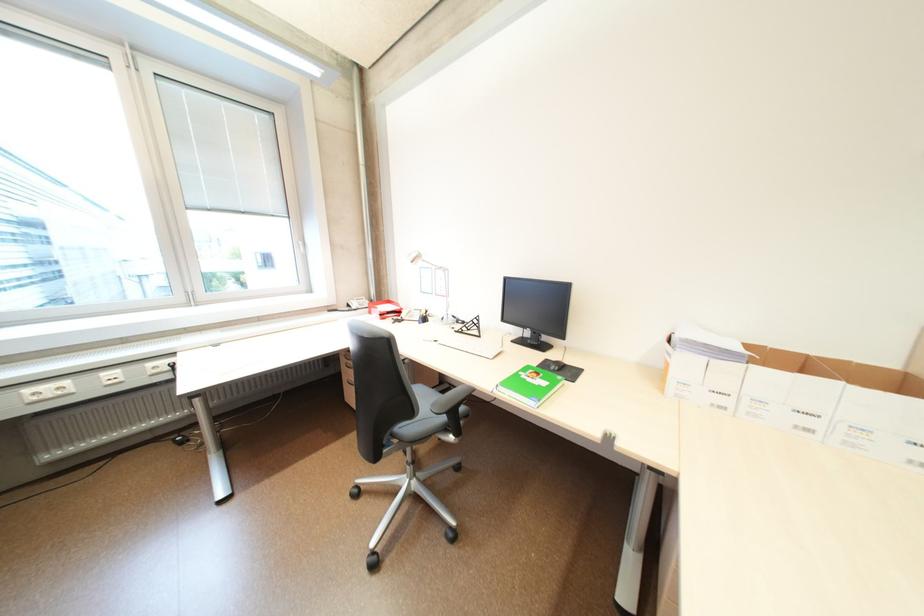
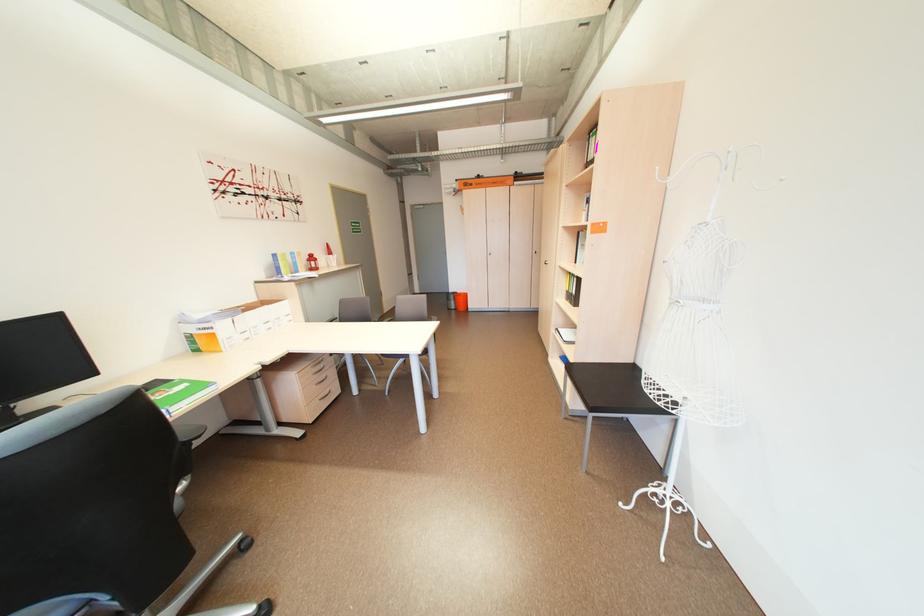
Locate, in the second image, the point that corresponds to [591,371] in the first image.

(164, 382)